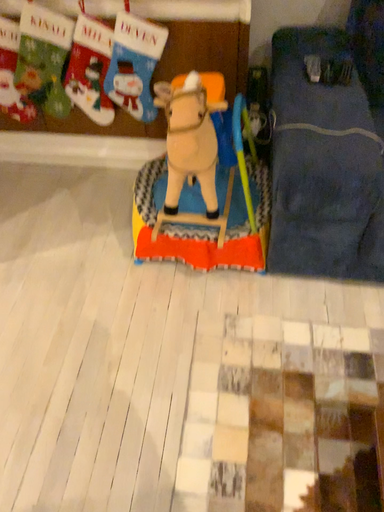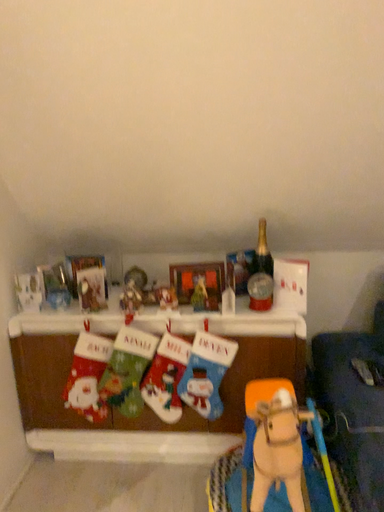
Question: Which way did the camera rotate in the video?

Choices:
 (A) rotated downward
 (B) rotated upward

Answer: (B)